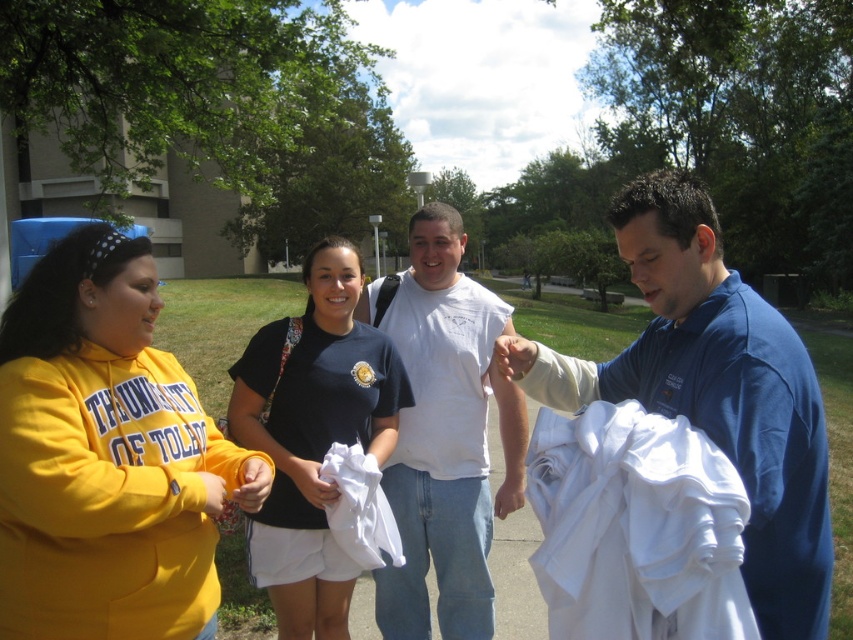
You are standing at the point with coordinates point (374,522) and want to walk to the building in the background. Is the point (457,376) in your way?

Point (457,376) is behind point (374,522), so it is not in your way when walking to the building in the background.

You are a photographer trying to capture a group photo of the white cotton shirt at right and the white cotton cloth at center. The camera you are using has a minimum focus distance of 3 feet. Will you be able to focus on both subjects simultaneously?

The distance between the white cotton shirt at right and the white cotton cloth at center is 4.04 feet, which is greater than the camera minimum focus distance of 3 feet. Therefore, the camera can focus on both subjects simultaneously.

You are standing at the center of the park and want to find the white cotton shirt at right. Based on the coordinates provided, in which direction should you move to locate it?

The white cotton shirt at right is located at coordinates point (636, 528), which means you should move to the right and slightly forward from your current position at the center to locate it.